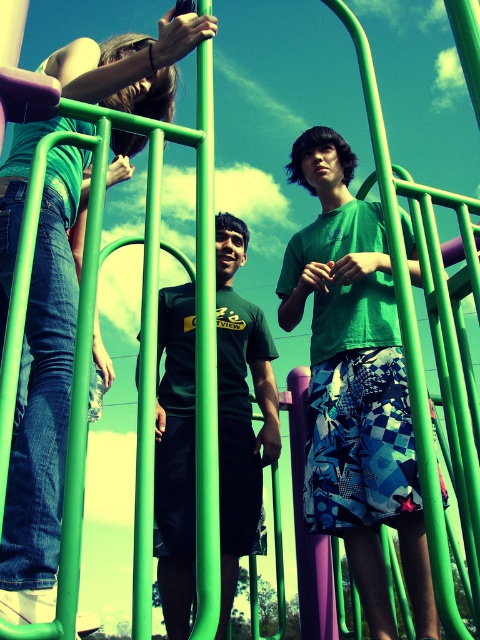
You are standing at the base of the playground structure and see the green matte shirt at upper center. If you want to wave to them, will your hand reach them if you stretch your arm out fully? Assume your arm is 2.5 feet long.

The green matte shirt at upper center and viewer are 4.00 feet apart. Since your arm is 2.5 feet long, you cannot reach them as the distance is greater than your arm length.